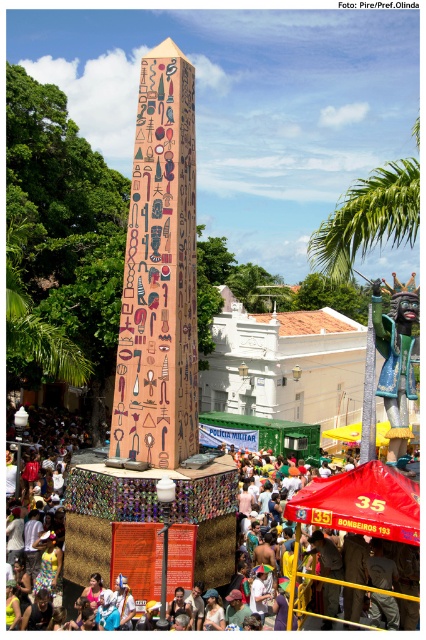
Is matte pink obelisk at center below red fabric canopy at center?

Actually, matte pink obelisk at center is above red fabric canopy at center.

Who is higher up, matte pink obelisk at center or red fabric canopy at center?

matte pink obelisk at center is above.

Locate an element on the screen. The height and width of the screenshot is (640, 426). matte pink obelisk at center is located at coordinates (160, 273).

Locate an element on the screen. matte pink obelisk at center is located at coordinates (160, 273).

Based on the photo, can you confirm if beige mosaic obelisk at center is positioned below multicolored mosaic crowd at center?

Incorrect, beige mosaic obelisk at center is not positioned below multicolored mosaic crowd at center.

What do you see at coordinates (160, 275) in the screenshot?
I see `beige mosaic obelisk at center` at bounding box center [160, 275].

Describe the element at coordinates (160, 275) in the screenshot. I see `beige mosaic obelisk at center` at that location.

Locate an element on the screen. The width and height of the screenshot is (426, 640). beige mosaic obelisk at center is located at coordinates (160, 275).

Does multicolored mosaic crowd at center appear under polychrome mosaic statue at right?

Indeed, multicolored mosaic crowd at center is positioned under polychrome mosaic statue at right.

Between point (348, 474) and point (402, 448), which one is positioned behind?

Point (402, 448)

Is point (95, 506) farther from camera compared to point (402, 381)?

No, (95, 506) is in front of (402, 381).

Find the location of a particular element. multicolored mosaic crowd at center is located at coordinates (100, 518).